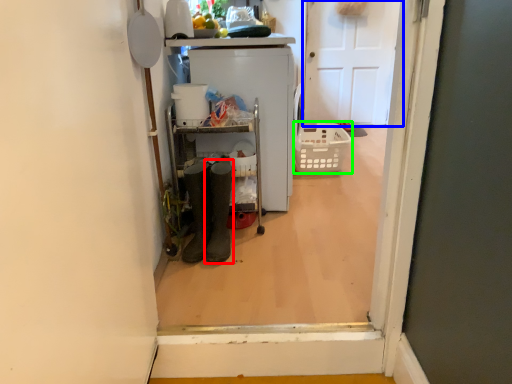
Question: Estimate the real-world distances between objects in this image. Which object is closer to footwear (highlighted by a red box), door (highlighted by a blue box) or basket (highlighted by a green box)?

Choices:
 (A) door
 (B) basket

Answer: (B)